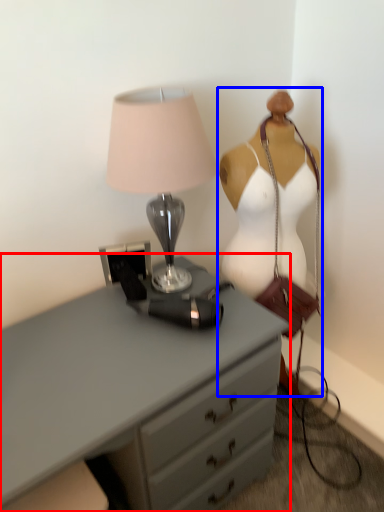
Question: Which object is further to the camera taking this photo, chest of drawers (highlighted by a red box) or mannequin (highlighted by a blue box)?

Choices:
 (A) chest of drawers
 (B) mannequin

Answer: (B)